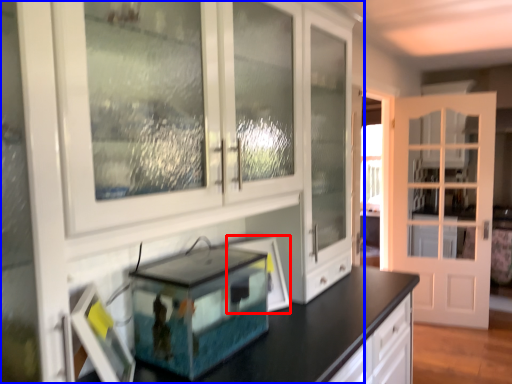
Question: Which object appears closest to the camera in this image, picture frame (highlighted by a red box) or cabinetry (highlighted by a blue box)?

Choices:
 (A) picture frame
 (B) cabinetry

Answer: (B)